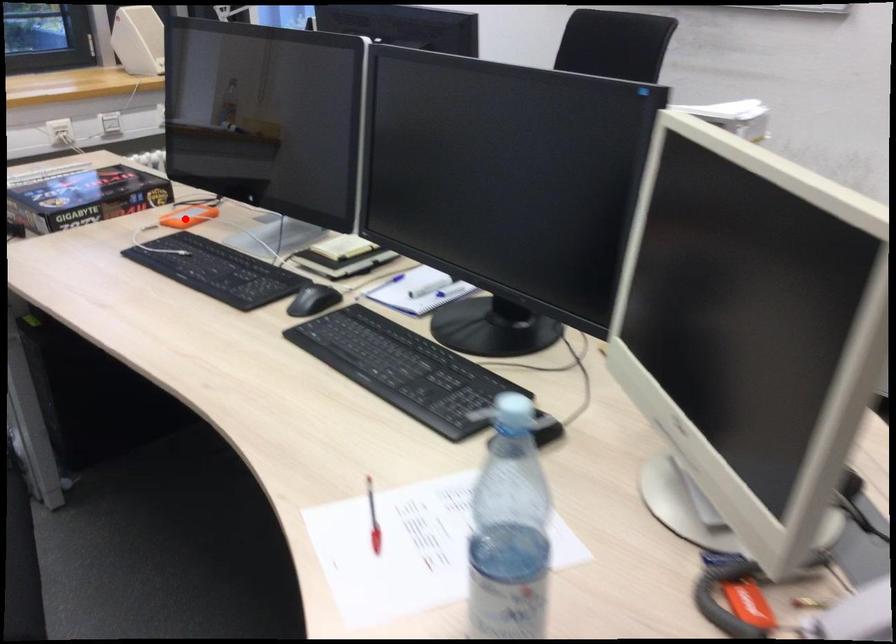
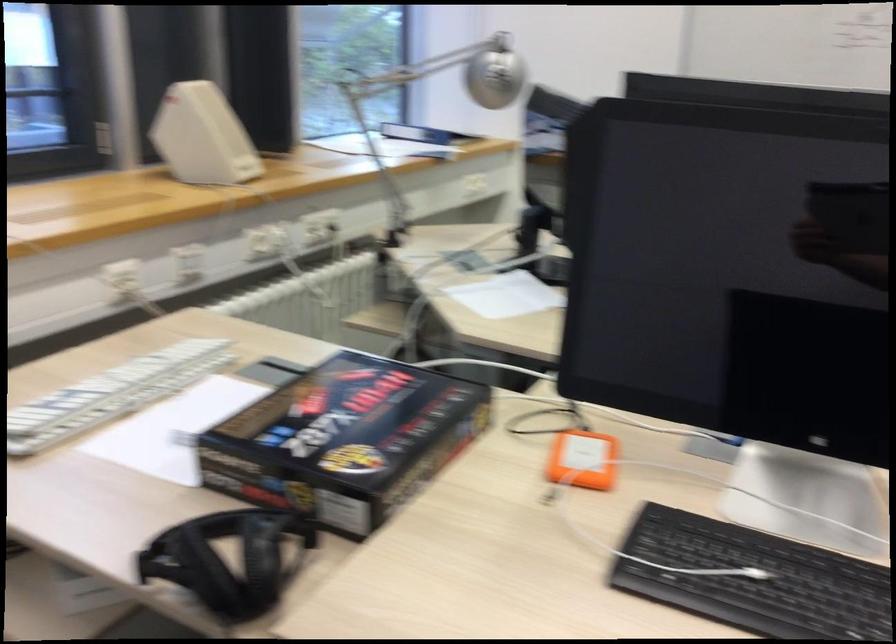
Question: I am providing you with two images of the same scene from different viewpoints. Given a red point in image1, look at the same physical point in image2. Is it:

Choices:
 (A) Closer to the viewpoint
 (B) Farther from the viewpoint

Answer: (A)